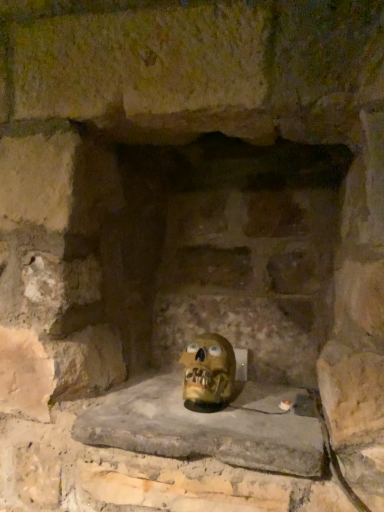
Question: Should I look upward or downward to see smooth stone window sill at center?

Choices:
 (A) up
 (B) down

Answer: (B)

Question: Considering the relative positions of smooth stone window sill at center and matte yellow skull at center in the image provided, is smooth stone window sill at center to the left of matte yellow skull at center from the viewer's perspective?

Choices:
 (A) yes
 (B) no

Answer: (A)

Question: Would you consider smooth stone window sill at center to be distant from matte yellow skull at center?

Choices:
 (A) no
 (B) yes

Answer: (A)

Question: Can you confirm if smooth stone window sill at center is shorter than matte yellow skull at center?

Choices:
 (A) no
 (B) yes

Answer: (B)

Question: Considering the relative sizes of smooth stone window sill at center and matte yellow skull at center in the image provided, is smooth stone window sill at center thinner than matte yellow skull at center?

Choices:
 (A) yes
 (B) no

Answer: (B)

Question: Does smooth stone window sill at center have a greater height compared to matte yellow skull at center?

Choices:
 (A) yes
 (B) no

Answer: (B)

Question: From the image's perspective, is smooth stone window sill at center located beneath matte yellow skull at center?

Choices:
 (A) yes
 (B) no

Answer: (A)

Question: From the image's perspective, is matte yellow skull at center below smooth stone window sill at center?

Choices:
 (A) no
 (B) yes

Answer: (A)

Question: Is matte yellow skull at center aimed at smooth stone window sill at center?

Choices:
 (A) no
 (B) yes

Answer: (A)

Question: From a real-world perspective, is matte yellow skull at center positioned over smooth stone window sill at center based on gravity?

Choices:
 (A) yes
 (B) no

Answer: (A)

Question: Can we say matte yellow skull at center lies outside smooth stone window sill at center?

Choices:
 (A) yes
 (B) no

Answer: (A)

Question: From a real-world perspective, is matte yellow skull at center beneath smooth stone window sill at center?

Choices:
 (A) no
 (B) yes

Answer: (A)

Question: Is matte yellow skull at center further to the viewer compared to smooth stone window sill at center?

Choices:
 (A) yes
 (B) no

Answer: (A)

Question: From their relative heights in the image, would you say smooth stone window sill at center is taller or shorter than matte yellow skull at center?

Choices:
 (A) tall
 (B) short

Answer: (B)